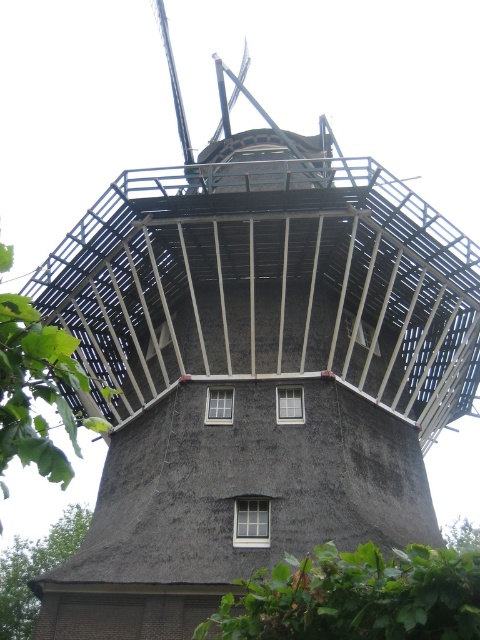
Question: Which object appears farthest from the camera in this image?

Choices:
 (A) green leafy tree at upper left
 (B) green thatch roof at lower left

Answer: (B)

Question: Can you confirm if green leafy tree at upper left is positioned above green thatch roof at lower left?

Choices:
 (A) yes
 (B) no

Answer: (A)

Question: Does green leafy tree at upper left have a larger size compared to green thatch roof at lower left?

Choices:
 (A) yes
 (B) no

Answer: (A)

Question: Which object is farther from the camera taking this photo?

Choices:
 (A) green leafy tree at upper left
 (B) green thatch roof at lower left

Answer: (B)

Question: Is green leafy tree at upper left to the right of green thatch roof at lower left from the viewer's perspective?

Choices:
 (A) no
 (B) yes

Answer: (B)